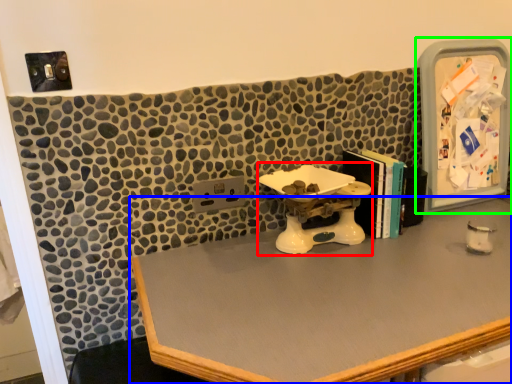
Question: Which object is the farthest from sink (highlighted by a red box)? Choose among these: desk (highlighted by a blue box) or medicine cabinet (highlighted by a green box).

Choices:
 (A) desk
 (B) medicine cabinet

Answer: (B)